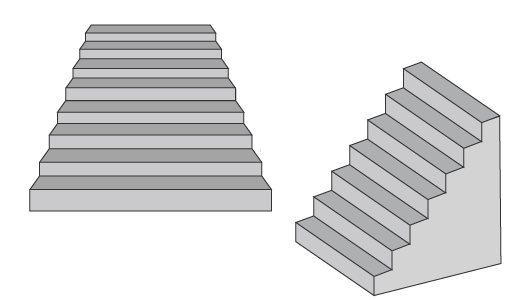
The height and width of the screenshot is (300, 520). I want to click on step on right staircase, so click(x=350, y=252), click(x=376, y=231), click(x=392, y=208), click(x=411, y=181), click(x=426, y=151), click(x=441, y=126), click(x=457, y=98).